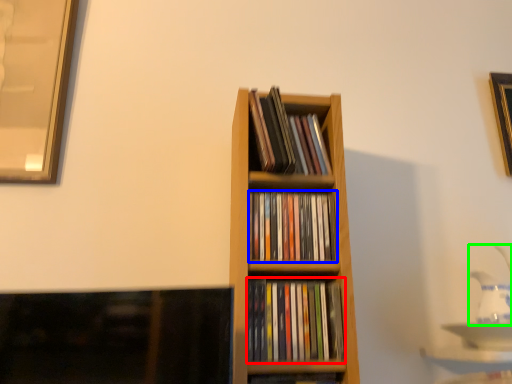
Question: Which is farther away from book (highlighted by a red box)? book (highlighted by a blue box) or tea pot (highlighted by a green box)?

Choices:
 (A) book
 (B) tea pot

Answer: (B)